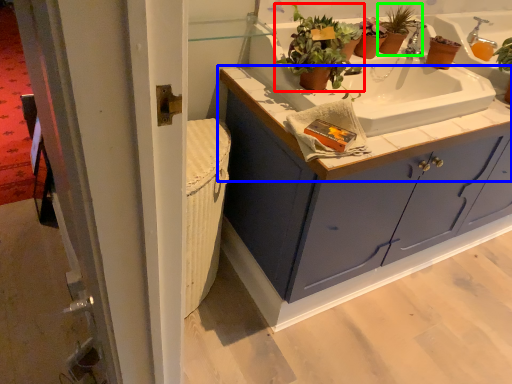
Question: Which object is positioned farthest from houseplant (highlighted by a red box)? Select from countertop (highlighted by a blue box) and houseplant (highlighted by a green box).

Choices:
 (A) countertop
 (B) houseplant

Answer: (B)